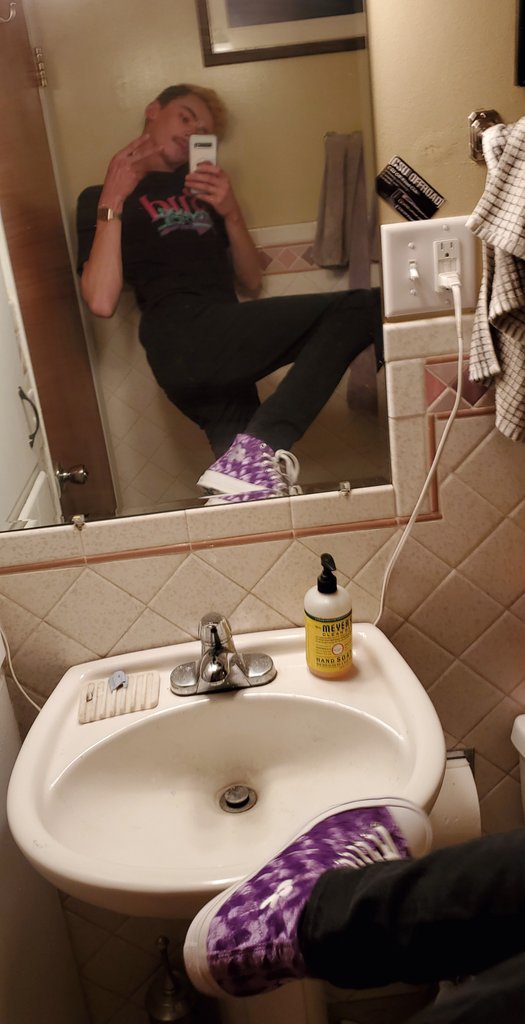
Where is `sink`? sink is located at coordinates (269, 766).